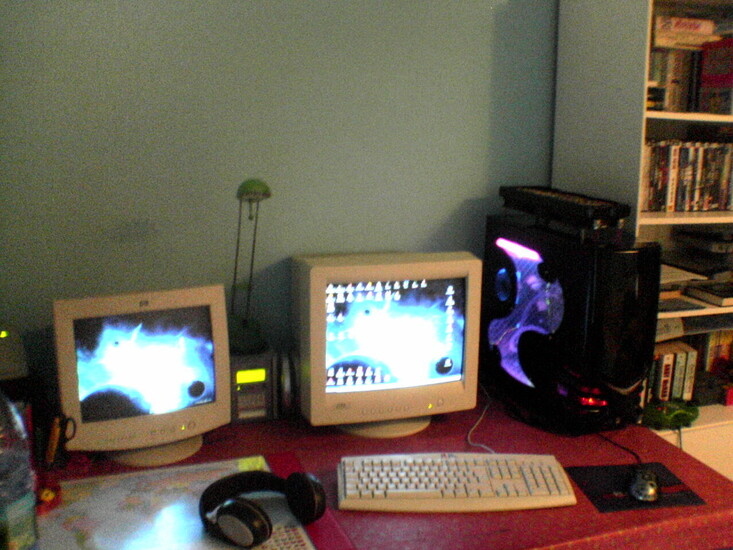
Where is `shelves`? shelves is located at coordinates (682, 182), (688, 273), (693, 368).